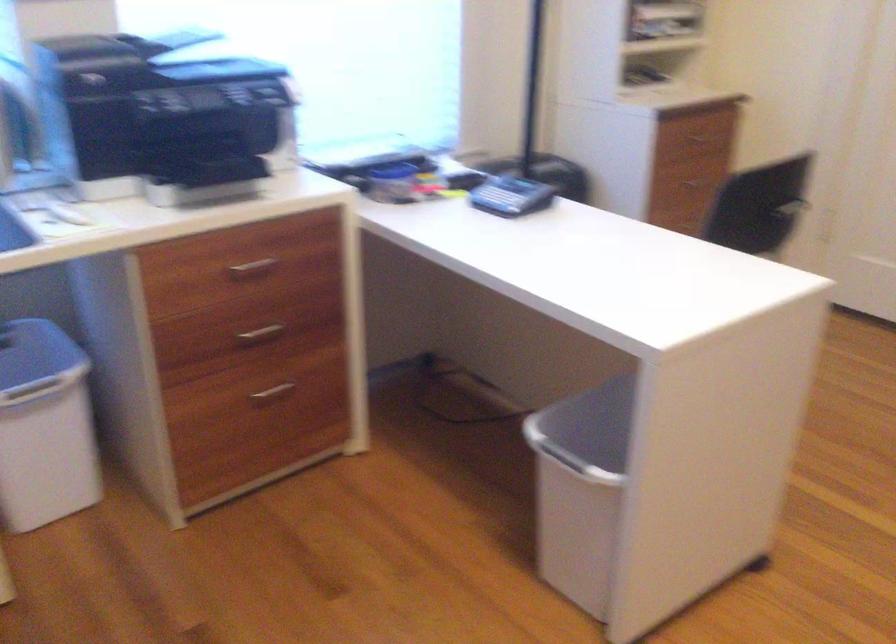
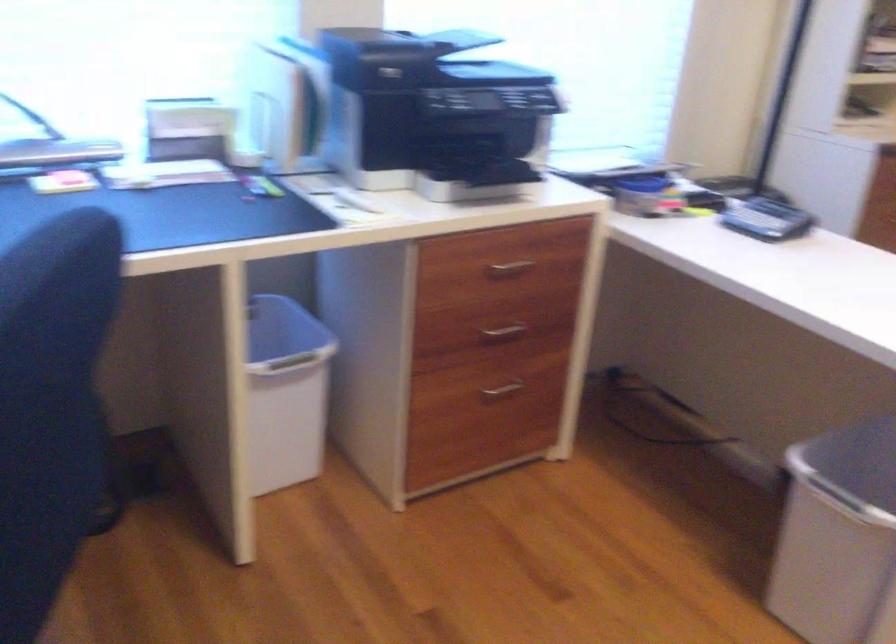
The point at (254, 268) is marked in the first image. Where is the corresponding point in the second image?

(510, 268)